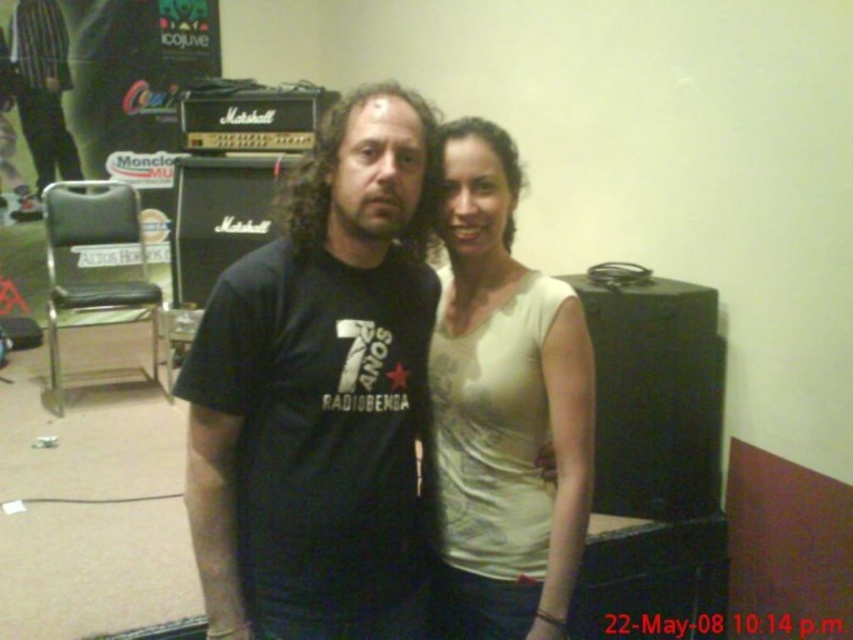
Is white matte tank top at center above matte black t-shirt at center?

Incorrect, white matte tank top at center is not positioned above matte black t-shirt at center.

Find the location of a particular element. This screenshot has width=853, height=640. white matte tank top at center is located at coordinates (505, 406).

Can you confirm if black matte t-shirt at center is positioned below matte black t-shirt at center?

Indeed, black matte t-shirt at center is positioned under matte black t-shirt at center.

Which of these two, black matte t-shirt at center or matte black t-shirt at center, stands taller?

matte black t-shirt at center is taller.

Between point (245, 348) and point (56, 8), which one is positioned behind?

The point (56, 8) is behind.

Image resolution: width=853 pixels, height=640 pixels. I want to click on black matte t-shirt at center, so click(318, 394).

Is black matte t-shirt at center bigger than white matte tank top at center?

Correct, black matte t-shirt at center is larger in size than white matte tank top at center.

Is point (183, 381) closer to viewer compared to point (505, 204)?

Yes.

Where is `black matte t-shirt at center`? The image size is (853, 640). black matte t-shirt at center is located at coordinates (318, 394).